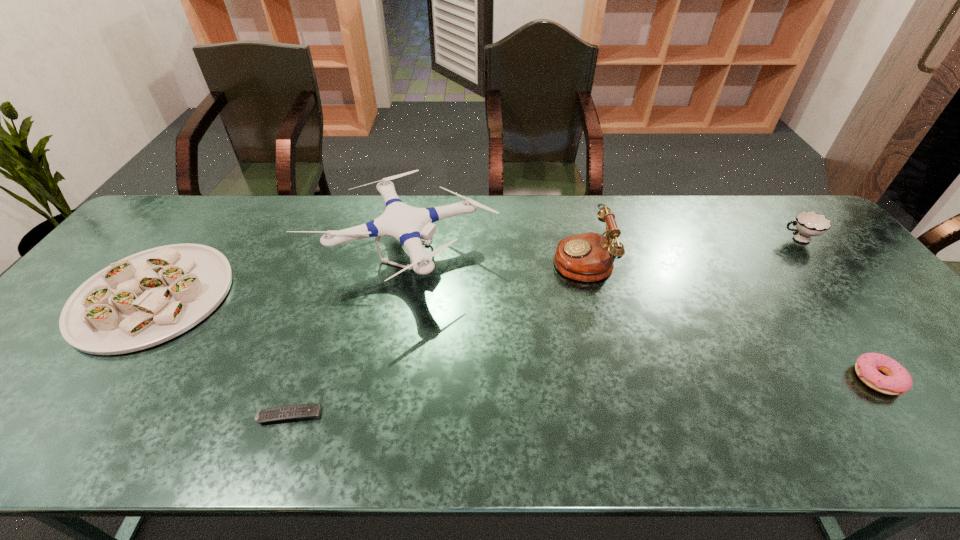
Find the location of a particular element. drone that is at the far edge is located at coordinates (407, 224).

The image size is (960, 540). I want to click on cup that is positioned at the far edge, so click(x=808, y=224).

I want to click on object located at the near edge, so click(302, 411).

Locate an element on the screen. Image resolution: width=960 pixels, height=540 pixels. object that is at the left edge is located at coordinates (148, 298).

This screenshot has width=960, height=540. Identify the location of cup that is at the right edge. (808, 224).

This screenshot has height=540, width=960. Identify the location of doughnut that is at the right edge. click(x=897, y=381).

This screenshot has width=960, height=540. I want to click on object at the far right corner, so click(x=808, y=224).

What are the coordinates of `vacant point at the far edge` in the screenshot? It's located at (292, 227).

This screenshot has width=960, height=540. Find the location of `blank space at the near edge`. blank space at the near edge is located at coordinates (934, 449).

In the image, there is a desktop. Where is `free space at the left edge`? Image resolution: width=960 pixels, height=540 pixels. free space at the left edge is located at coordinates (29, 357).